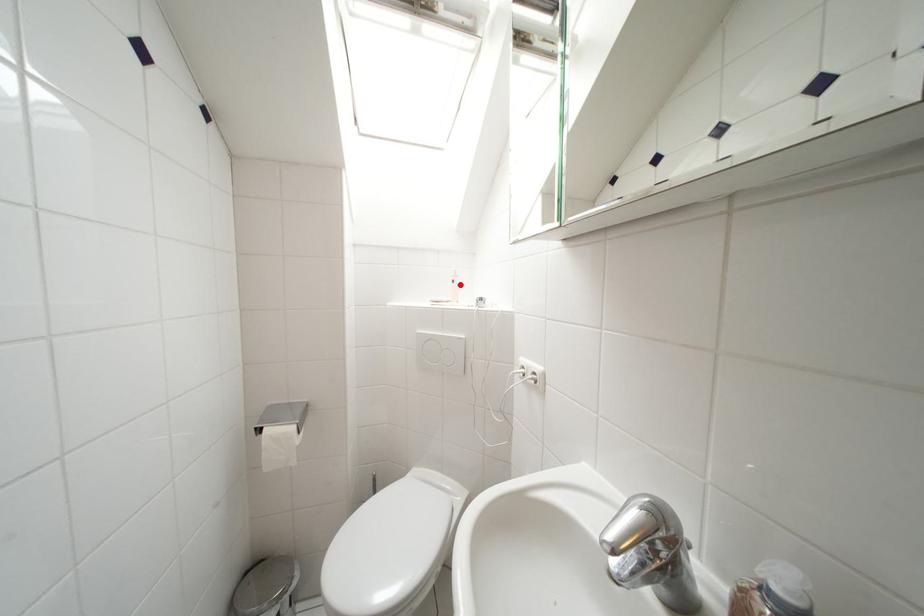
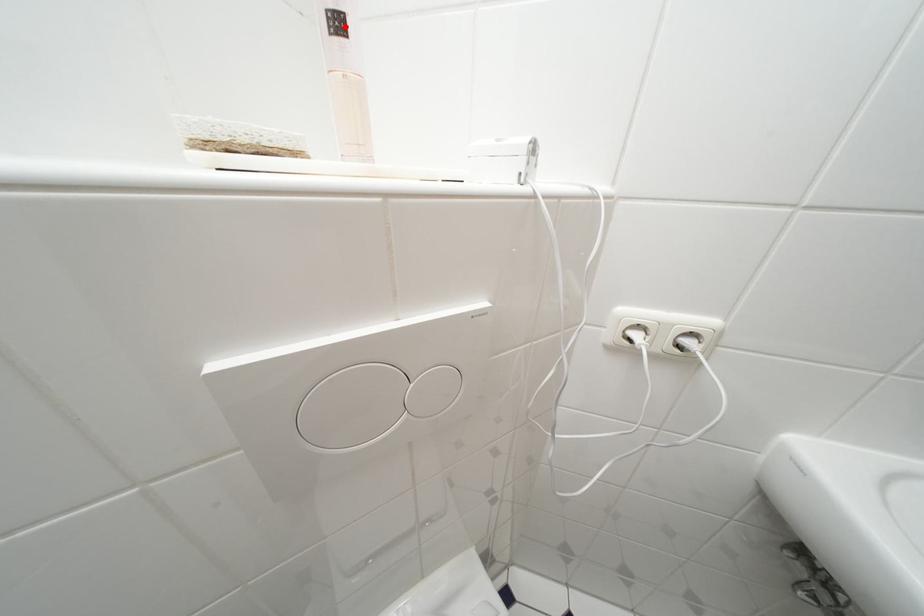
Based on the photo, I am providing you with two images of the same scene from different viewpoints. A red point is marked on the first image and another point is marked on the second image. Is the red point in image1 aligned with the point shown in image2?

Yes